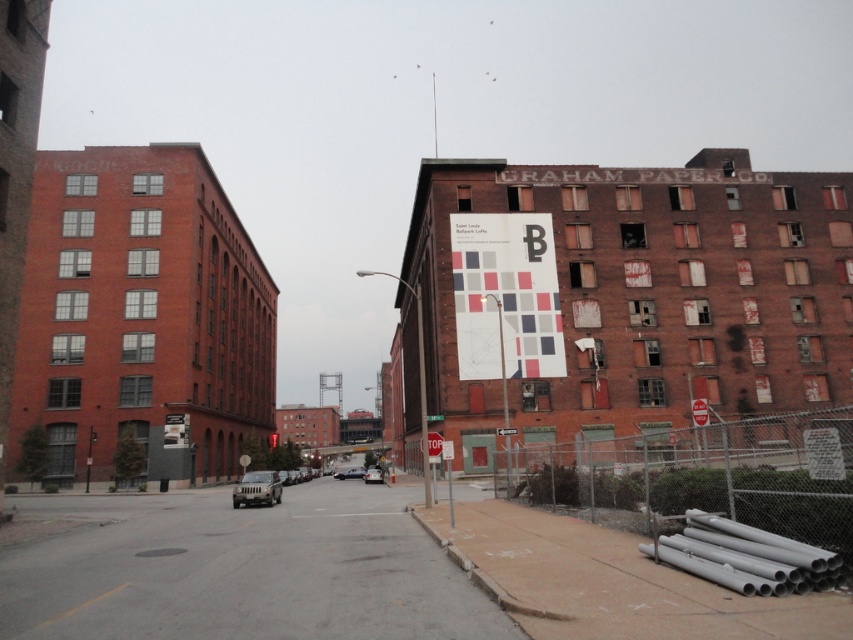
Question: Can you confirm if gray chain-link fence at lower right is positioned below matte silver suv at center?

Choices:
 (A) no
 (B) yes

Answer: (A)

Question: Which object appears closest to the camera in this image?

Choices:
 (A) white paper sign at upper center
 (B) gray chain-link fence at lower right
 (C) metallic silver car at center

Answer: (B)

Question: Is matte silver suv at center above red paper sign at center?

Choices:
 (A) no
 (B) yes

Answer: (A)

Question: Is gray chain-link fence at lower right below red paper sign at center?

Choices:
 (A) no
 (B) yes

Answer: (A)

Question: Which of the following is the closest to the observer?

Choices:
 (A) silver metallic sedan at center
 (B) matte silver suv at center
 (C) red paper sign at center

Answer: (C)

Question: Which point is closer to the camera?

Choices:
 (A) (363, 476)
 (B) (271, 476)
 (C) (802, 529)
 (D) (432, 442)

Answer: (C)